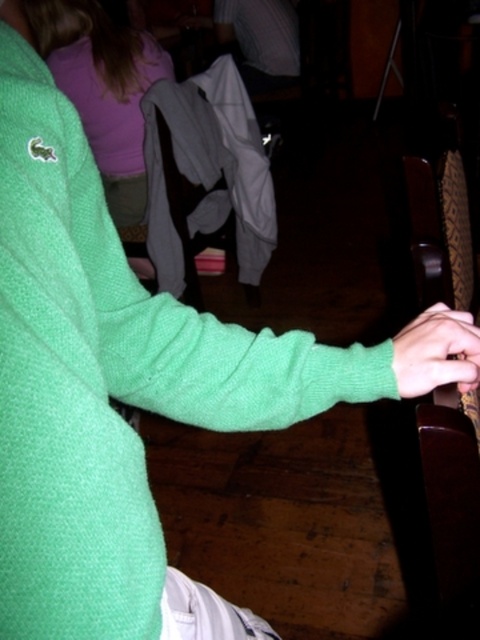
Question: Which object appears closest to the camera in this image?

Choices:
 (A) matte green sweater at upper left
 (B) green fleece hand at lower right

Answer: (B)

Question: Which point is closer to the camera?

Choices:
 (A) matte green sweater at upper left
 (B) green fleece hand at lower right

Answer: (B)

Question: Is matte green sweater at upper left below green fleece hand at lower right?

Choices:
 (A) no
 (B) yes

Answer: (A)

Question: From the image, what is the correct spatial relationship of matte green sweater at upper left in relation to green fleece hand at lower right?

Choices:
 (A) above
 (B) below

Answer: (A)

Question: Is matte green sweater at upper left below green fleece hand at lower right?

Choices:
 (A) no
 (B) yes

Answer: (A)